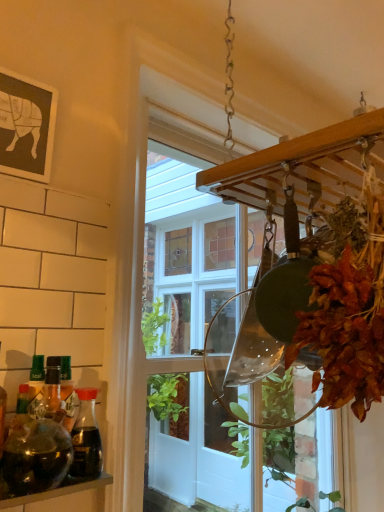
Question: Considering the relative sizes of translucent glass bottle at left, which is the 1th bottle from back to front, and transparent glass jar at lower left in the image provided, is translucent glass bottle at left, which is the 1th bottle from back to front, bigger than transparent glass jar at lower left?

Choices:
 (A) yes
 (B) no

Answer: (B)

Question: Is translucent glass bottle at left, which is the 1th bottle from back to front, closer to camera compared to transparent glass jar at lower left?

Choices:
 (A) yes
 (B) no

Answer: (B)

Question: Does translucent glass bottle at left, the second bottle viewed from the front, have a lesser height compared to transparent glass jar at lower left?

Choices:
 (A) yes
 (B) no

Answer: (B)

Question: Is translucent glass bottle at left, the second bottle viewed from the front, oriented towards transparent glass jar at lower left?

Choices:
 (A) no
 (B) yes

Answer: (A)

Question: In the image, is translucent glass bottle at left, which ranks as the 2th bottle in back-to-front order, positioned in front of or behind transparent glass jar at lower left?

Choices:
 (A) behind
 (B) front

Answer: (A)

Question: From the image's perspective, relative to transparent glass jar at lower left, is translucent glass bottle at left, the 1th bottle in the front-to-back sequence, above or below?

Choices:
 (A) above
 (B) below

Answer: (A)

Question: Would you say translucent glass bottle at left, which ranks as the 2th bottle in back-to-front order, is inside or outside transparent glass jar at lower left?

Choices:
 (A) outside
 (B) inside

Answer: (A)

Question: Considering the positions of point (16, 437) and point (76, 483), is point (16, 437) closer or farther from the camera than point (76, 483)?

Choices:
 (A) farther
 (B) closer

Answer: (A)

Question: Looking at their shapes, would you say transparent glass jar at lower left is wider or thinner than translucent glass bottle at left, which ranks as the 2th bottle in back-to-front order?

Choices:
 (A) thin
 (B) wide

Answer: (B)

Question: Is transparent glass jar at lower left bigger or smaller than translucent glass bottle at left, which ranks as the 2th bottle in back-to-front order?

Choices:
 (A) small
 (B) big

Answer: (B)

Question: Considering the relative positions of transparent glass jar at lower left and translucent glass bottle at left, which ranks as the 2th bottle in back-to-front order, in the image provided, is transparent glass jar at lower left to the left or to the right of translucent glass bottle at left, which ranks as the 2th bottle in back-to-front order,?

Choices:
 (A) left
 (B) right

Answer: (A)

Question: Is point (24, 500) positioned closer to the camera than point (59, 453)?

Choices:
 (A) farther
 (B) closer

Answer: (A)

Question: From the image's perspective, is clear glass window at center positioned above or below transparent glass jar at lower left?

Choices:
 (A) above
 (B) below

Answer: (A)

Question: In the image, is clear glass window at center positioned in front of or behind transparent glass jar at lower left?

Choices:
 (A) behind
 (B) front

Answer: (A)